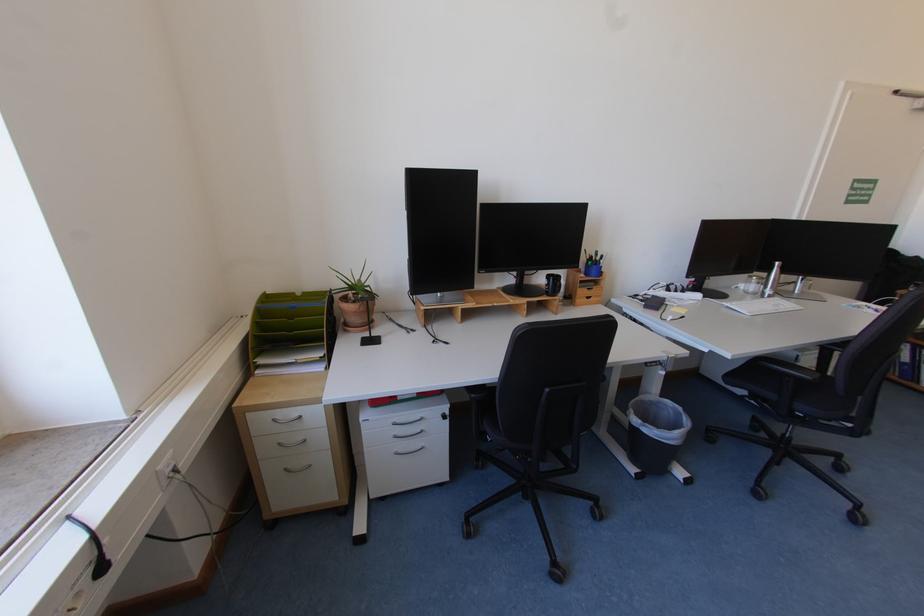
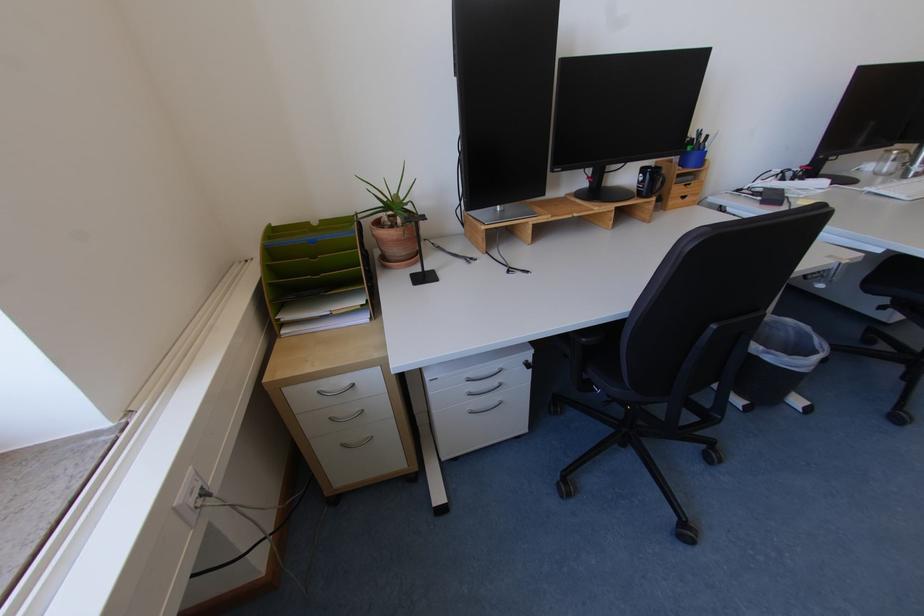
Find the pixel in the second image that matches point 361,310 in the first image.

(403, 238)